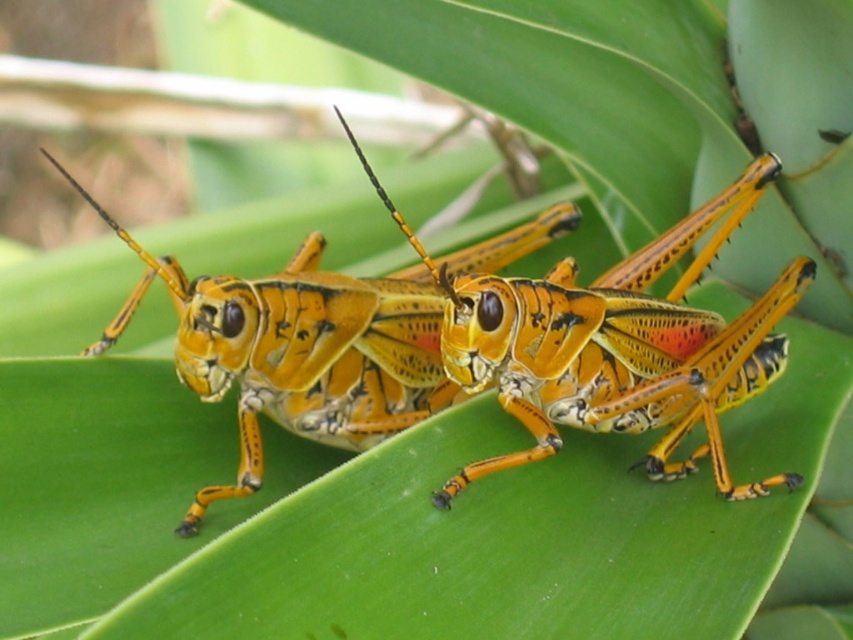
You are standing at the point where the grasshoppers are resting on the leaf. You want to move to the point marked as point (627, 326). Can you reach it without moving more than 4.5 feet?

The distance between you and point (627, 326) is 4.53 feet, which is slightly more than 4.5 feet. Therefore, you cannot reach it without moving more than 4.5 feet.

You are a researcher studying the grasshoppers in the image. You need to locate a specific point at coordinates point (614, 342). Which grasshopper is this point located on?

The point (614, 342) is located on the orange_yellow textured grasshopper at center.